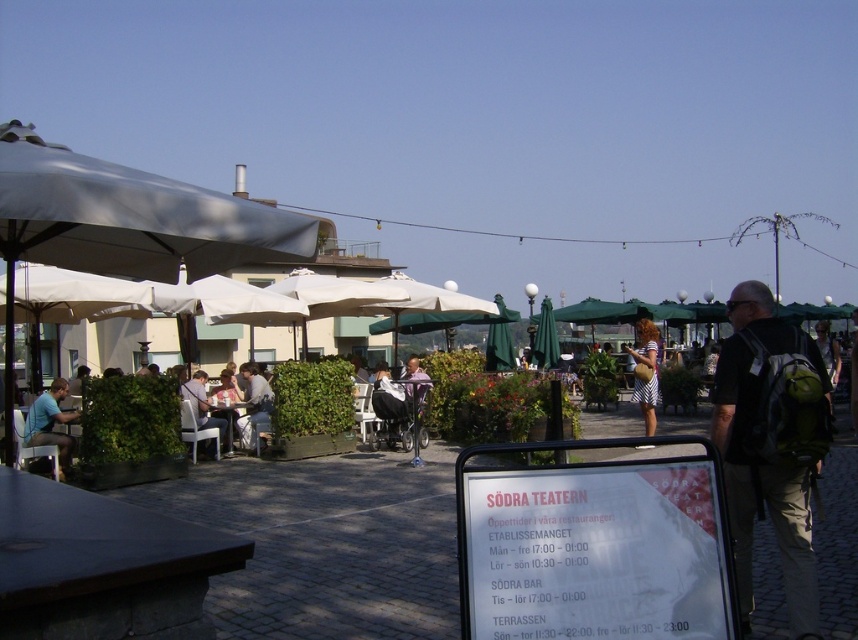
Question: Is white paper sign at center wider than striped dress at center?

Choices:
 (A) yes
 (B) no

Answer: (B)

Question: Based on their relative distances, which object is nearer to the matte gray shirt at center?

Choices:
 (A) gray fabric umbrella at upper left
 (B) matte black shirt at lower left
 (C) striped dress at center

Answer: (B)

Question: Based on their relative distances, which object is nearer to the striped dress at center?

Choices:
 (A) dark green backpack at right
 (B) matte gray shirt at center

Answer: (B)

Question: Considering the real-world distances, which object is farthest from the matte black shirt at lower left?

Choices:
 (A) white paper sign at center
 (B) striped dress at center
 (C) gray fabric umbrella at upper left
 (D) dark green backpack at right

Answer: (A)

Question: Is white paper sign at center positioned behind matte black shirt at lower left?

Choices:
 (A) no
 (B) yes

Answer: (A)

Question: Is white paper sign at center wider than dark green backpack at right?

Choices:
 (A) yes
 (B) no

Answer: (A)